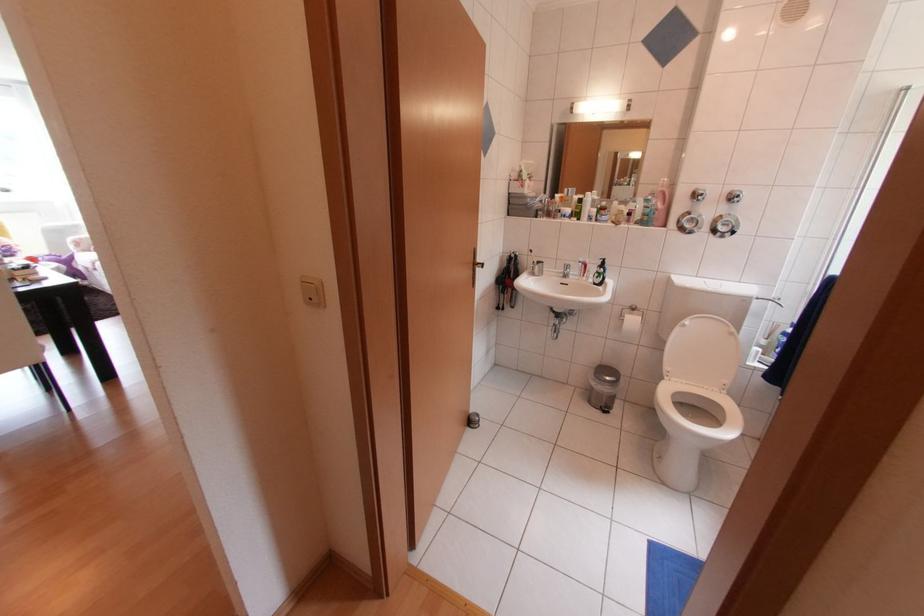
Where would you lift the white toilet lid? Please return your answer as a coordinate pair (x, y).

(701, 353)